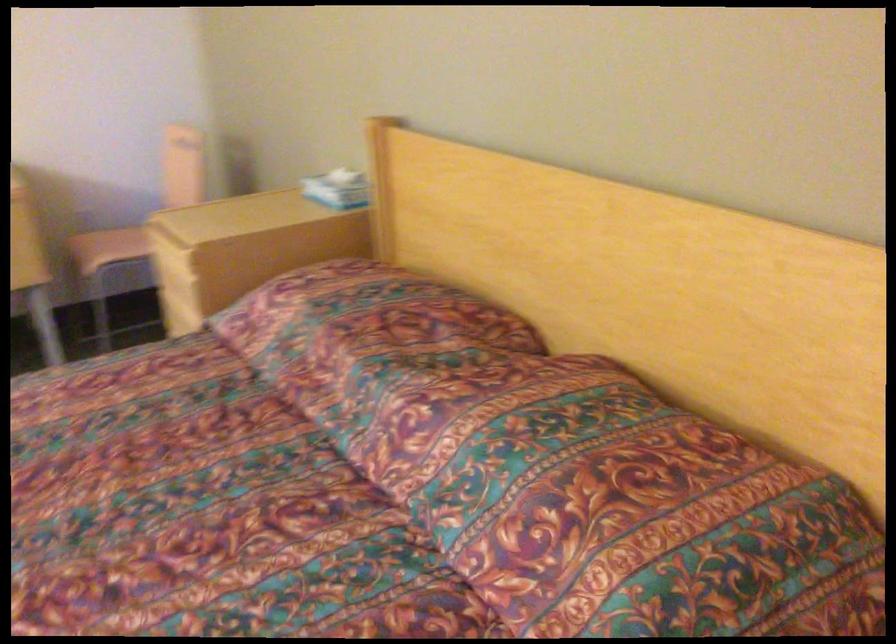
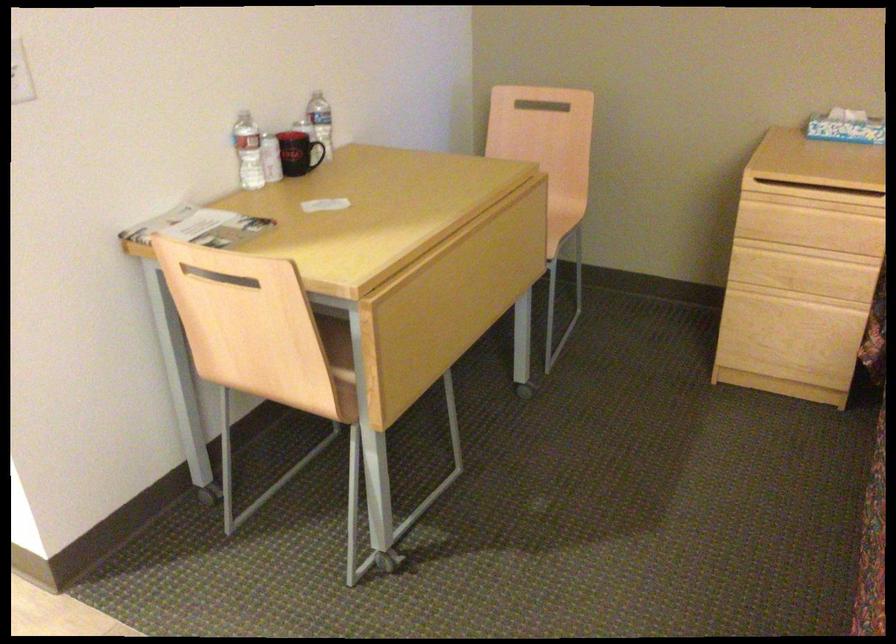
Question: I am providing you with two images of the same scene from different viewpoints. After the viewpoint changes to image2, which objects are now occluded?

Choices:
 (A) plastic water bottle
 (B) black mug handle
 (C) chair sitting surface
 (D) green cardboard tray

Answer: (C)